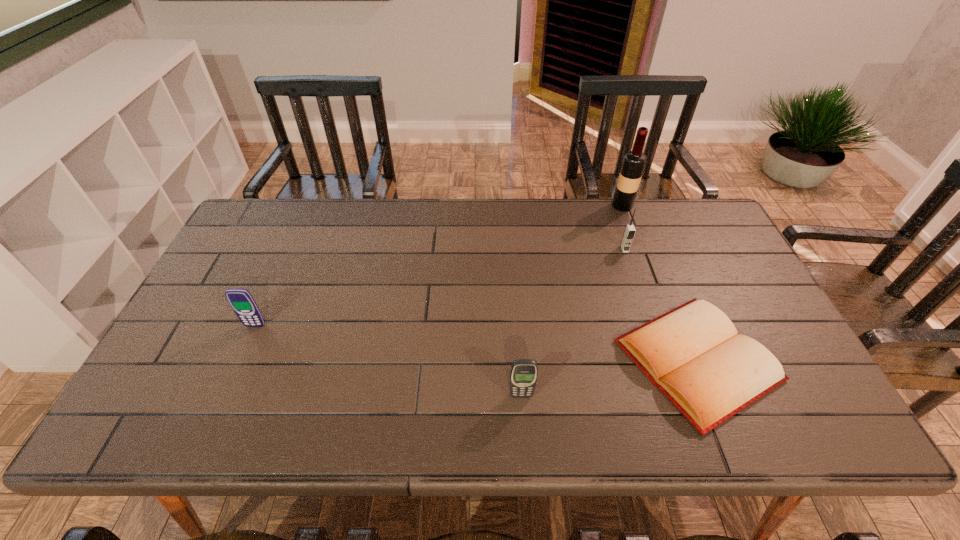
Locate an element on the screen. This screenshot has height=540, width=960. vacant space at the near edge is located at coordinates (459, 424).

What are the coordinates of `vacant area at the left edge` in the screenshot? It's located at (242, 273).

Locate an element on the screen. The width and height of the screenshot is (960, 540). free spot at the near left corner of the desktop is located at coordinates (178, 409).

This screenshot has height=540, width=960. I want to click on vacant space at the far right corner, so click(661, 204).

Where is `vacant area that lies between the shortest object and the second cellular telephone from left to right`? This screenshot has height=540, width=960. vacant area that lies between the shortest object and the second cellular telephone from left to right is located at coordinates (610, 378).

At what (x,y) coordinates should I click in order to perform the action: click on free space between the tallest object and the second cellular telephone from right to left. Please return your answer as a coordinate pair (x, y). This screenshot has height=540, width=960. Looking at the image, I should click on (571, 300).

Identify the location of free space that is in between the leftmost cellular telephone and the second object from left to right. (388, 361).

Locate an element on the screen. Image resolution: width=960 pixels, height=540 pixels. free space between the second farthest cellular telephone and the fourth object from right to left is located at coordinates (388, 361).

Identify the location of free space between the fourth object from right to left and the leftmost cellular telephone. (388, 361).

The image size is (960, 540). Identify the location of unoccupied area between the rightmost cellular telephone and the nearest cellular telephone. (573, 322).